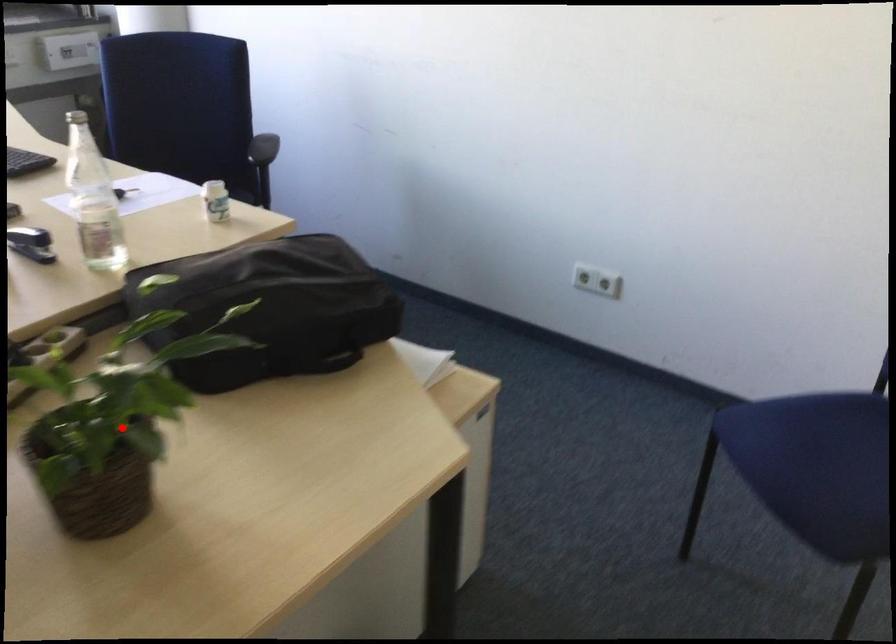
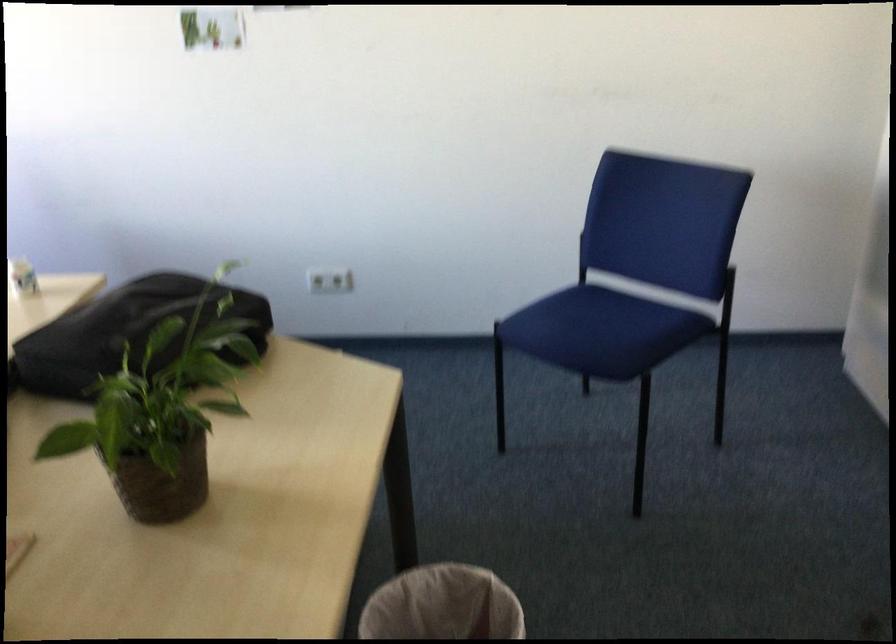
In the second image, find the point that corresponds to the highlighted location in the first image.

(162, 413)